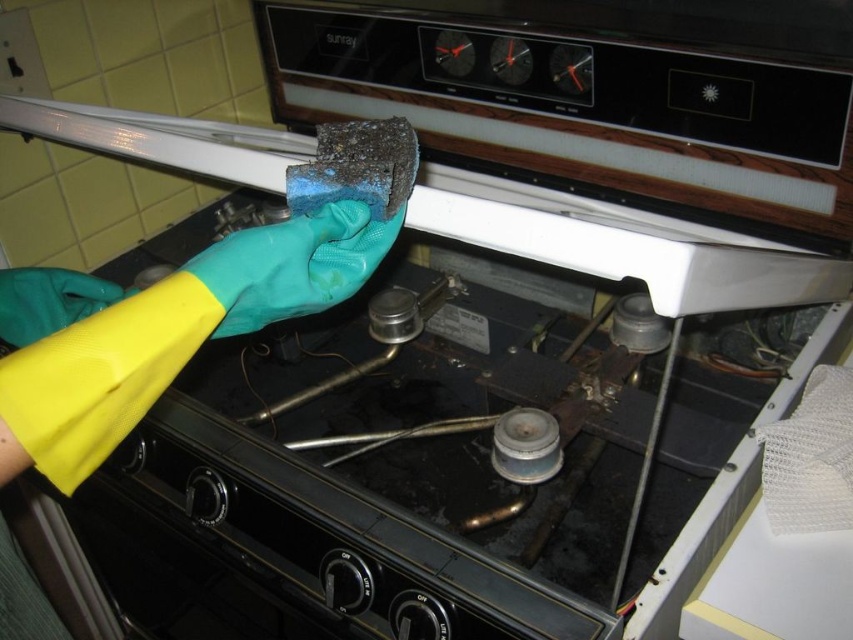
You are a cleaning robot with a 12 inch arm reach. You need to pick up the yellow rubber glove at lower left. Can your arm reach it?

The yellow rubber glove at lower left is 14.53 inches away from the camera, which is beyond the robot arm reach of 12 inches. Therefore, the robot cannot reach it.

You are a home inspector checking the gloves used for cleaning. You notice the yellow rubber glove at lower left and the blue rubber glove at center. Which glove is located below the other?

The yellow rubber glove at lower left is positioned under the blue rubber glove at center, so it is below the blue one.